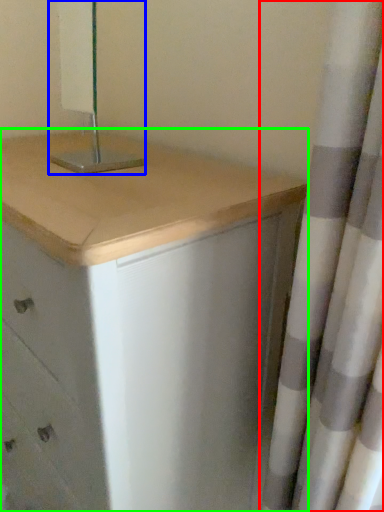
Question: Which object is the closest to the curtain (highlighted by a red box)? Choose among these: bedside lamp (highlighted by a blue box) or chest of drawers (highlighted by a green box).

Choices:
 (A) bedside lamp
 (B) chest of drawers

Answer: (B)